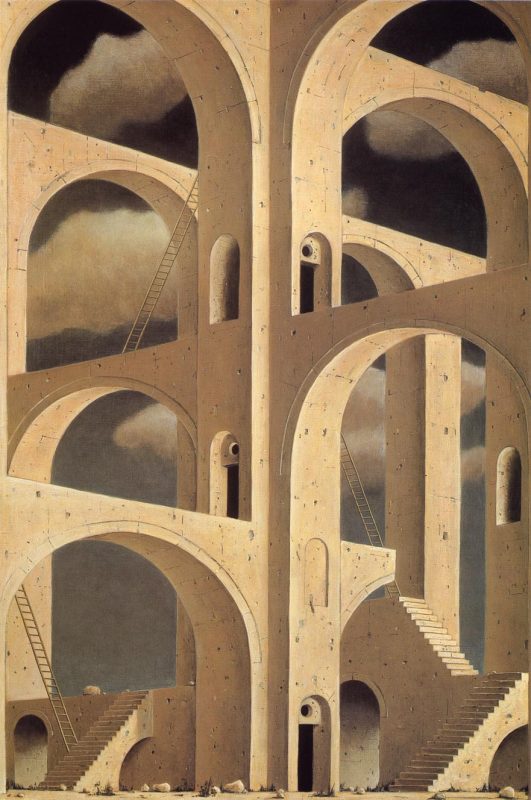
In order to click on 2nd floor staircase in this screenshot , I will do `click(405, 636)`.